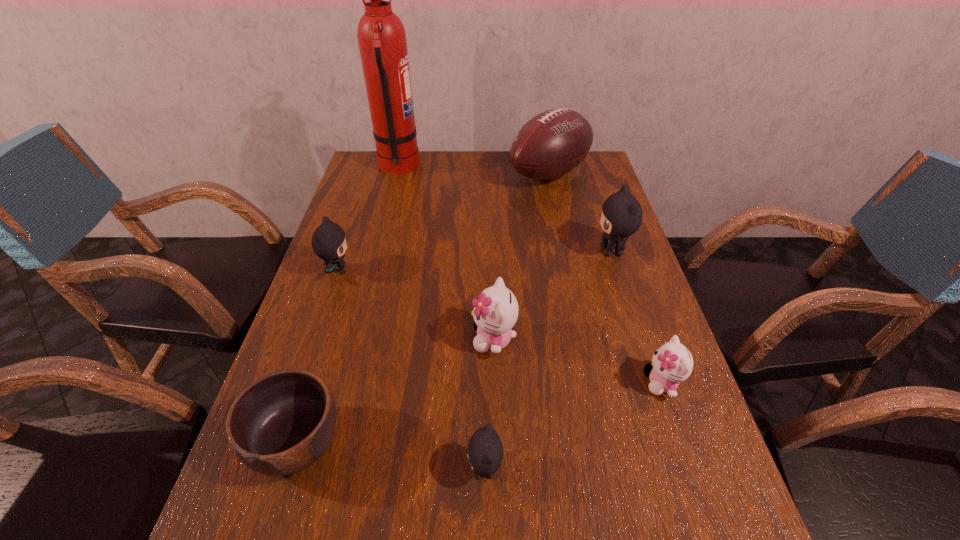
Find the location of a particular element. The width and height of the screenshot is (960, 540). vacant space situated on the front-facing side of the smaller white kitten is located at coordinates (606, 382).

Identify the location of vacant space situated 0.390m on the front-facing side of the smaller white kitten. (458, 382).

This screenshot has height=540, width=960. I want to click on vacant area situated on the front-facing side of the smaller white kitten, so pyautogui.click(x=463, y=382).

Locate an element on the screen. Image resolution: width=960 pixels, height=540 pixels. free space located 0.150m on the front-facing side of the smallest gray kitten is located at coordinates (384, 470).

This screenshot has height=540, width=960. What are the coordinates of `free space located on the front-facing side of the smallest gray kitten` in the screenshot? It's located at (301, 470).

At what (x,y) coordinates should I click in order to perform the action: click on vacant space located on the front-facing side of the smallest gray kitten. Please return your answer as a coordinate pair (x, y). Looking at the image, I should click on (390, 470).

Image resolution: width=960 pixels, height=540 pixels. Find the location of `fire extinguisher positioned at the far edge`. fire extinguisher positioned at the far edge is located at coordinates (381, 36).

Where is `football (American) that is at the far edge`? The height and width of the screenshot is (540, 960). football (American) that is at the far edge is located at coordinates (552, 143).

You are a GUI agent. You are given a task and a screenshot of the screen. Output one action in this format:
    pyautogui.click(x=<x>, y=<y>)
    Task: Click on the fire extinguisher situated at the left edge
    This screenshot has width=960, height=540.
    Given the screenshot: What is the action you would take?
    pyautogui.click(x=381, y=36)

What are the coordinates of `kitten present at the left edge` in the screenshot? It's located at (329, 242).